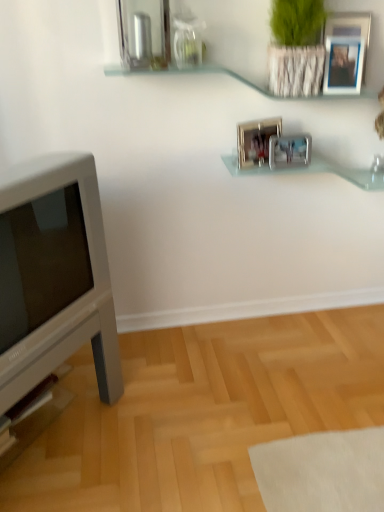
Identify the location of clear glass shelf at upper center, the 1th shelf in the top-to-bottom sequence. The width and height of the screenshot is (384, 512). (189, 73).

In the scene shown: How much space does clear glass shelf at upper center, which is counted as the 2th shelf, starting from the bottom, occupy horizontally?

clear glass shelf at upper center, which is counted as the 2th shelf, starting from the bottom, is 8.22 inches wide.

What do you see at coordinates (56, 275) in the screenshot? I see `white glossy television at left` at bounding box center [56, 275].

This screenshot has height=512, width=384. In order to click on clear glass shelf at upper center, which is counted as the 2th shelf, starting from the bottom in this screenshot , I will do `click(189, 73)`.

What's the angular difference between metallic silver picture frame at center, the 2th picture frame viewed from the left, and metallic silver picture frame at center, the second picture frame positioned from the bottom,'s facing directions?

16.4 degrees separate the facing orientations of metallic silver picture frame at center, the 2th picture frame viewed from the left, and metallic silver picture frame at center, the second picture frame positioned from the bottom.

Where is `the 1st picture frame above the metallic silver picture frame at center, which is the first picture frame from bottom to top (from a real-world perspective)`? The width and height of the screenshot is (384, 512). the 1st picture frame above the metallic silver picture frame at center, which is the first picture frame from bottom to top (from a real-world perspective) is located at coordinates pos(256,141).

Does metallic silver picture frame at center, the 2th picture frame viewed from the left, have a greater width compared to metallic silver picture frame at center, the second picture frame positioned from the bottom?

No, metallic silver picture frame at center, the 2th picture frame viewed from the left, is not wider than metallic silver picture frame at center, the second picture frame positioned from the bottom.

Considering the points (301, 157) and (276, 119), which point is in front, point (301, 157) or point (276, 119)?

Point (301, 157)

Are clear glass shelf at upper center, which is counted as the 2th shelf, starting from the bottom, and metallic silver picture frame at center, which is the 2th picture frame in right-to-left order, far apart?

clear glass shelf at upper center, which is counted as the 2th shelf, starting from the bottom, is near metallic silver picture frame at center, which is the 2th picture frame in right-to-left order, not far away.

I want to click on picture frame that is the 2nd one when counting rightward from the clear glass shelf at upper center, the 1th shelf in the top-to-bottom sequence, so click(289, 151).

Considering the sizes of clear glass shelf at upper center, the 1th shelf in the top-to-bottom sequence, and metallic silver picture frame at center, which is the 2th picture frame in right-to-left order, in the image, is clear glass shelf at upper center, the 1th shelf in the top-to-bottom sequence, taller or shorter than metallic silver picture frame at center, which is the 2th picture frame in right-to-left order,?

Considering their sizes, clear glass shelf at upper center, the 1th shelf in the top-to-bottom sequence, has less height than metallic silver picture frame at center, which is the 2th picture frame in right-to-left order.

From the image's perspective, which is above, metallic silver picture frame at upper center, acting as the first picture frame starting from the top, or clear glass shelf at center, which is counted as the first shelf, starting from the bottom?

From the image's view, metallic silver picture frame at upper center, acting as the first picture frame starting from the top, is above.

Is metallic silver picture frame at upper center, acting as the 3th picture frame starting from the left, facing towards clear glass shelf at center, which is counted as the first shelf, starting from the bottom?

No, metallic silver picture frame at upper center, acting as the 3th picture frame starting from the left, is not turned towards clear glass shelf at center, which is counted as the first shelf, starting from the bottom.

Is metallic silver picture frame at upper center, acting as the 3th picture frame starting from the left, positioned beyond the bounds of clear glass shelf at center, the 2th shelf when ordered from top to bottom?

metallic silver picture frame at upper center, acting as the 3th picture frame starting from the left, lies outside clear glass shelf at center, the 2th shelf when ordered from top to bottom,'s area.

At what (x,y) coordinates should I click in order to perform the action: click on the 1st shelf counting from the left of the metallic silver picture frame at upper center, acting as the 3th picture frame starting from the left. Please return your answer as a coordinate pair (x, y). Image resolution: width=384 pixels, height=512 pixels. Looking at the image, I should click on (317, 170).

Does clear glass shelf at upper center, which is counted as the 2th shelf, starting from the bottom, lie behind green textured plant at upper right?

Yes, the depth of clear glass shelf at upper center, which is counted as the 2th shelf, starting from the bottom, is greater than that of green textured plant at upper right.

From a real-world perspective, is clear glass shelf at upper center, which is counted as the 2th shelf, starting from the bottom, physically located above or below green textured plant at upper right?

clear glass shelf at upper center, which is counted as the 2th shelf, starting from the bottom, is below green textured plant at upper right.

Is clear glass shelf at upper center, which is counted as the 2th shelf, starting from the bottom, thinner than green textured plant at upper right?

Correct, the width of clear glass shelf at upper center, which is counted as the 2th shelf, starting from the bottom, is less than that of green textured plant at upper right.

How many degrees apart are the facing directions of clear glass shelf at center, the 2th shelf when ordered from top to bottom, and metallic silver picture frame at upper center, marked as the 1th picture frame in a right-to-left arrangement?

The angle between the facing direction of clear glass shelf at center, the 2th shelf when ordered from top to bottom, and the facing direction of metallic silver picture frame at upper center, marked as the 1th picture frame in a right-to-left arrangement, is 1.29 degrees.

The width and height of the screenshot is (384, 512). Find the location of `the 2nd shelf positioned below the metallic silver picture frame at upper center, acting as the first picture frame starting from the top (from a real-world perspective)`. the 2nd shelf positioned below the metallic silver picture frame at upper center, acting as the first picture frame starting from the top (from a real-world perspective) is located at coordinates (317, 170).

Between clear glass shelf at center, the 2th shelf when ordered from top to bottom, and metallic silver picture frame at upper center, the third picture frame ordered from the bottom, which one has less height?

Standing shorter between the two is clear glass shelf at center, the 2th shelf when ordered from top to bottom.

Which is less distant, (322, 165) or (355, 39)?

The point (355, 39) is in front.

Are metallic silver picture frame at center, the 2th picture frame viewed from the left, and clear glass shelf at center, the 2th shelf when ordered from top to bottom, far apart?

metallic silver picture frame at center, the 2th picture frame viewed from the left, is near clear glass shelf at center, the 2th shelf when ordered from top to bottom, not far away.

What are the coordinates of `shelf lying on the right of metallic silver picture frame at center, the third picture frame from the top` in the screenshot? It's located at (317, 170).

Does metallic silver picture frame at center, the 2th picture frame viewed from the left, have a greater height compared to clear glass shelf at center, the 2th shelf when ordered from top to bottom?

In fact, metallic silver picture frame at center, the 2th picture frame viewed from the left, may be shorter than clear glass shelf at center, the 2th shelf when ordered from top to bottom.

Between metallic silver picture frame at center, the third picture frame from the top, and clear glass shelf at center, which is counted as the first shelf, starting from the bottom, which one appears on the right side from the viewer's perspective?

clear glass shelf at center, which is counted as the first shelf, starting from the bottom, is more to the right.

Is white glossy television at left taller or shorter than metallic silver picture frame at center, the second picture frame positioned from the bottom?

In the image, white glossy television at left appears to be taller than metallic silver picture frame at center, the second picture frame positioned from the bottom.

How far apart are white glossy television at left and metallic silver picture frame at center, which is the 3th picture frame in right-to-left order?

white glossy television at left is 34.66 inches away from metallic silver picture frame at center, which is the 3th picture frame in right-to-left order.

From the image's perspective, which object appears higher, white glossy television at left or metallic silver picture frame at center, acting as the 2th picture frame starting from the top?

metallic silver picture frame at center, acting as the 2th picture frame starting from the top, from the image's perspective.

Which object is positioned more to the left, white glossy television at left or metallic silver picture frame at center, the second picture frame positioned from the bottom?

From the viewer's perspective, white glossy television at left appears more on the left side.

The image size is (384, 512). I want to click on the 1st picture frame in front of the metallic silver picture frame at center, which is the 2th picture frame in right-to-left order, so click(256, 141).

Starting from the clear glass shelf at upper center, the 1th shelf in the top-to-bottom sequence, which picture frame is the 2nd one to the right? Please provide its 2D coordinates.

[(289, 151)]

When comparing their distances from clear glass shelf at upper center, which is counted as the 2th shelf, starting from the bottom, does white glossy television at left or metallic silver picture frame at upper center, marked as the 1th picture frame in a right-to-left arrangement, seem further?

white glossy television at left is further to clear glass shelf at upper center, which is counted as the 2th shelf, starting from the bottom.

Looking at the image, which one is located closer to green textured plant at upper right, clear glass shelf at center, which is counted as the first shelf, starting from the bottom, or white glossy television at left?

clear glass shelf at center, which is counted as the first shelf, starting from the bottom, lies closer to green textured plant at upper right than the other object.

Looking at the image, which one is located further to metallic silver picture frame at upper center, acting as the 3th picture frame starting from the left, green textured plant at upper right or clear glass shelf at center, the 2th shelf when ordered from top to bottom?

Among the two, clear glass shelf at center, the 2th shelf when ordered from top to bottom, is located further to metallic silver picture frame at upper center, acting as the 3th picture frame starting from the left.

Based on their spatial positions, is metallic silver picture frame at center, which is the 2th picture frame in right-to-left order, or clear glass shelf at upper center, the 1th shelf in the top-to-bottom sequence, closer to clear glass shelf at center, which is counted as the first shelf, starting from the bottom?

Among the two, metallic silver picture frame at center, which is the 2th picture frame in right-to-left order, is located nearer to clear glass shelf at center, which is counted as the first shelf, starting from the bottom.

When comparing their distances from metallic silver picture frame at upper center, acting as the 3th picture frame starting from the left, does white glossy television at left or green textured plant at upper right seem further?

Based on the image, white glossy television at left appears to be further to metallic silver picture frame at upper center, acting as the 3th picture frame starting from the left.

Which object lies nearer to the anchor point metallic silver picture frame at center, the third picture frame from the top, metallic silver picture frame at center, which is the 3th picture frame in right-to-left order, or green textured plant at upper right?

The object closer to metallic silver picture frame at center, the third picture frame from the top, is metallic silver picture frame at center, which is the 3th picture frame in right-to-left order.

Looking at the image, which one is located further to white glossy television at left, clear glass shelf at upper center, the 1th shelf in the top-to-bottom sequence, or clear glass shelf at center, which is counted as the first shelf, starting from the bottom?

clear glass shelf at center, which is counted as the first shelf, starting from the bottom.

Which object lies nearer to the anchor point metallic silver picture frame at center, the 2th picture frame viewed from the left, metallic silver picture frame at upper center, the third picture frame ordered from the bottom, or white glossy television at left?

metallic silver picture frame at upper center, the third picture frame ordered from the bottom, is closer to metallic silver picture frame at center, the 2th picture frame viewed from the left.

Locate an element on the screen. The image size is (384, 512). shelf between white glossy television at left and metallic silver picture frame at center, which is the first picture frame from bottom to top, in the horizontal direction is located at coordinates (189, 73).

Find the location of a particular element. Image resolution: width=384 pixels, height=512 pixels. shelf between white glossy television at left and metallic silver picture frame at center, which is the 3th picture frame in right-to-left order is located at coordinates (189, 73).

Find the location of a particular element. Image resolution: width=384 pixels, height=512 pixels. plant between white glossy television at left and metallic silver picture frame at center, which is the 2th picture frame in right-to-left order, in the horizontal direction is located at coordinates (295, 48).

I want to click on picture frame between white glossy television at left and metallic silver picture frame at center, which is the 2th picture frame in right-to-left order, from left to right, so click(256, 141).